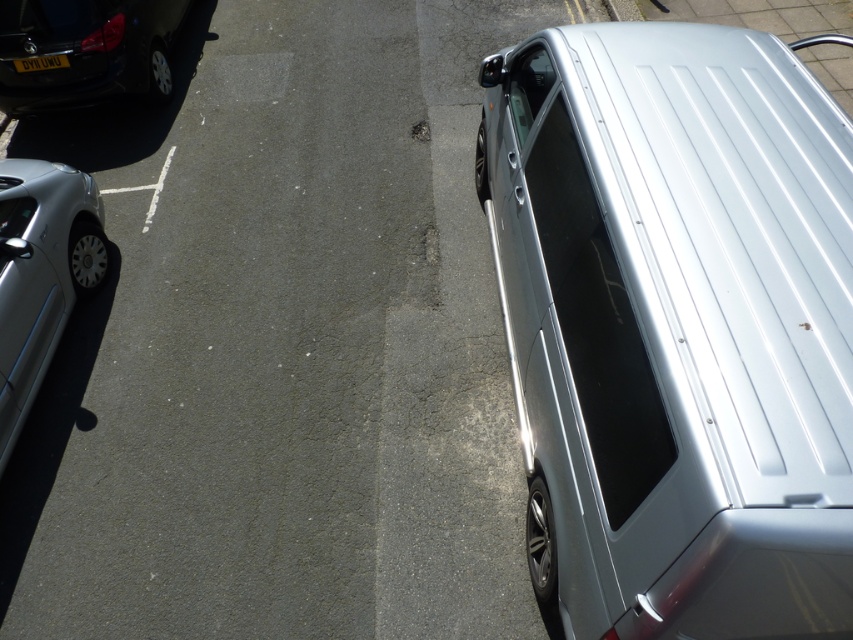
You are a delivery person with a cart that is 1.7 meters wide. You need to move between the metallic silver van at center and the satin silver van at right to reach the delivery point. Can your cart fit through the space between them?

The metallic silver van at center and the satin silver van at right are 1.68 meters apart from each other. Since the cart is 1.7 meters wide, it cannot fit through the space between them as the gap is narrower than the cart.

You are standing at the entrance of the parking lot and want to locate the metallic silver van at center. According to the coordinates provided, where should you look to find it?

The metallic silver van at center is located at coordinates point [283,348].